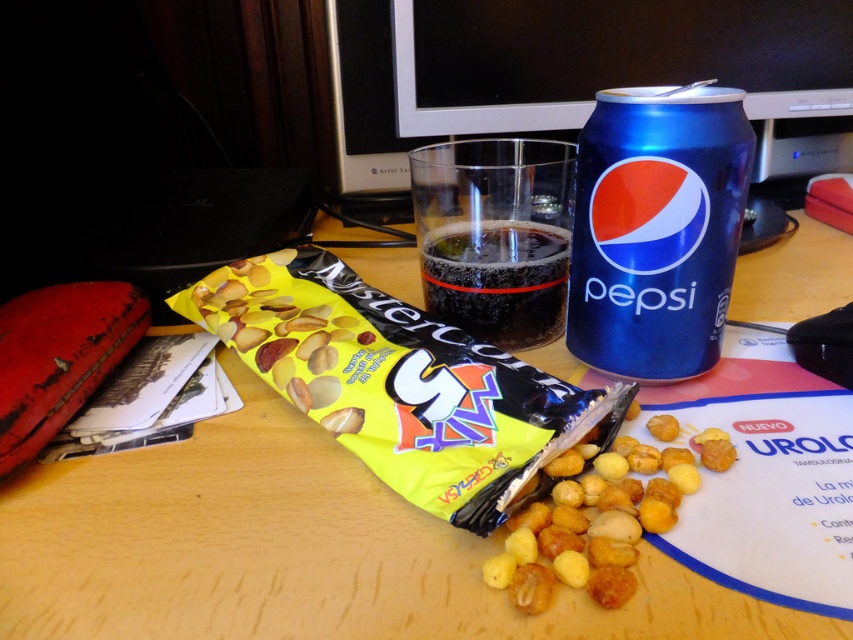
Question: Which is nearer to the yellow matte snack at center?

Choices:
 (A) blue metallic can at upper right
 (B) wooden table at center
 (C) black glossy monitor at upper center

Answer: (A)

Question: From the image, what is the correct spatial relationship of yellow matte snack mix at center in relation to blue metallic can at upper right?

Choices:
 (A) above
 (B) below

Answer: (B)

Question: Is wooden table at center thinner than yellow matte snack at center?

Choices:
 (A) yes
 (B) no

Answer: (B)

Question: Which object is positioned closest to the yellow matte snack at center?

Choices:
 (A) dark carbonated liquid at center
 (B) yellow matte snack mix at center

Answer: (B)

Question: Which object is the closest to the dark carbonated liquid at center?

Choices:
 (A) black glossy monitor at upper center
 (B) yellow matte snack mix at center
 (C) wooden table at center

Answer: (B)

Question: Considering the relative positions of yellow matte snack mix at center and blue metallic can at upper right in the image provided, where is yellow matte snack mix at center located with respect to blue metallic can at upper right?

Choices:
 (A) right
 (B) left

Answer: (B)